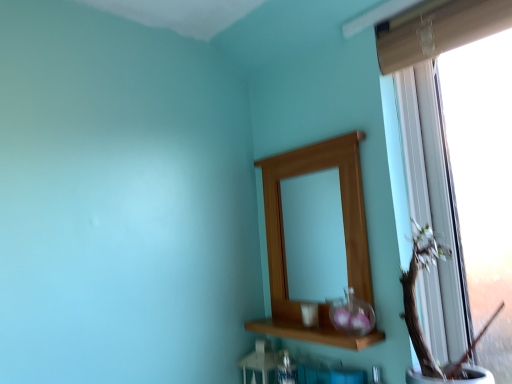
Question: Does wooden mirror at upper center turn towards wooden vase at right?

Choices:
 (A) no
 (B) yes

Answer: (A)

Question: Considering the relative sizes of wooden mirror at upper center and wooden vase at right in the image provided, is wooden mirror at upper center taller than wooden vase at right?

Choices:
 (A) no
 (B) yes

Answer: (B)

Question: Is wooden mirror at upper center to the left of wooden vase at right from the viewer's perspective?

Choices:
 (A) no
 (B) yes

Answer: (B)

Question: Is the position of wooden mirror at upper center more distant than that of wooden vase at right?

Choices:
 (A) no
 (B) yes

Answer: (B)

Question: Is the surface of wooden mirror at upper center in direct contact with wooden vase at right?

Choices:
 (A) yes
 (B) no

Answer: (B)

Question: Is wooden mirror at upper center shorter than wooden vase at right?

Choices:
 (A) yes
 (B) no

Answer: (B)

Question: Does wooden vase at right have a larger size compared to wooden mirror at upper center?

Choices:
 (A) no
 (B) yes

Answer: (B)

Question: Is wooden vase at right positioned beyond the bounds of wooden mirror at upper center?

Choices:
 (A) no
 (B) yes

Answer: (B)

Question: Considering the relative positions of wooden vase at right and wooden mirror at upper center in the image provided, is wooden vase at right to the left of wooden mirror at upper center from the viewer's perspective?

Choices:
 (A) yes
 (B) no

Answer: (B)

Question: Is wooden vase at right positioned with its back to wooden mirror at upper center?

Choices:
 (A) yes
 (B) no

Answer: (B)

Question: Can you confirm if wooden vase at right is taller than wooden mirror at upper center?

Choices:
 (A) no
 (B) yes

Answer: (A)

Question: Considering the relative positions of wooden vase at right and wooden mirror at upper center in the image provided, is wooden vase at right in front of wooden mirror at upper center?

Choices:
 (A) yes
 (B) no

Answer: (A)

Question: Could you tell me if transparent glass vase at center is turned towards wooden vase at right?

Choices:
 (A) yes
 (B) no

Answer: (B)